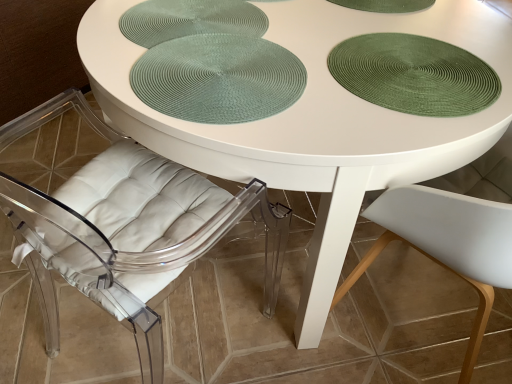
Find the location of a particular element. This screenshot has width=512, height=384. free spot above green woven placemat at center (from a real-world perspective) is located at coordinates (210, 74).